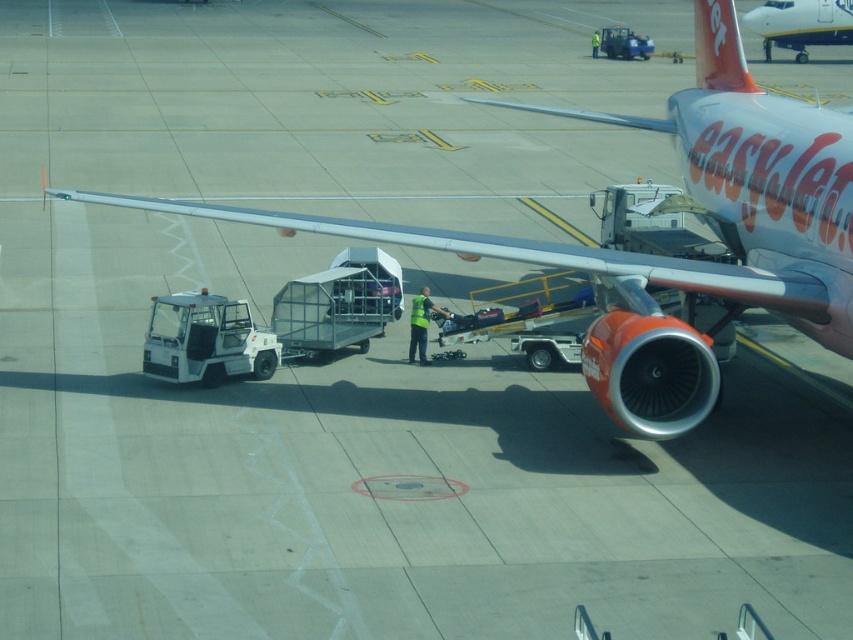
Question: Is white glossy airplane at upper right bigger than green reflective vest at center?

Choices:
 (A) no
 (B) yes

Answer: (B)

Question: Observing the image, what is the correct spatial positioning of metallic silver airplane at center in reference to white glossy airplane at upper right?

Choices:
 (A) below
 (B) above

Answer: (A)

Question: Estimate the real-world distances between objects in this image. Which object is closer to the white glossy airplane at upper right?

Choices:
 (A) green reflective vest at center
 (B) metallic silver airplane at center

Answer: (B)

Question: Which point is farther from the camera taking this photo?

Choices:
 (A) (802, 35)
 (B) (426, 324)
 (C) (799, 328)

Answer: (A)

Question: Is white glossy airplane at upper right to the right of green reflective vest at center from the viewer's perspective?

Choices:
 (A) no
 (B) yes

Answer: (B)

Question: Which object appears closest to the camera in this image?

Choices:
 (A) green reflective vest at center
 (B) metallic silver airplane at center
 (C) white glossy airplane at upper right

Answer: (B)